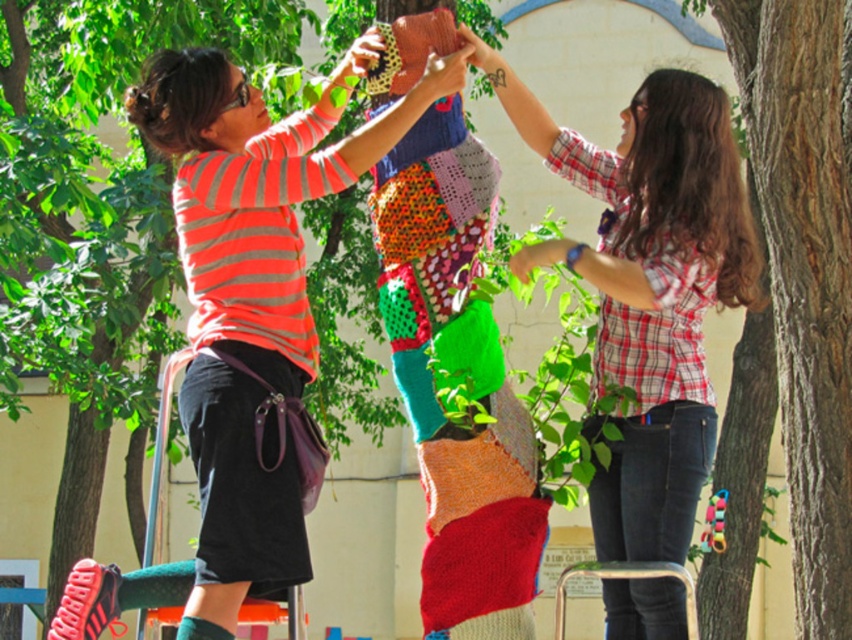
Question: Is plaid shirt at upper right positioned behind rough bark tree at upper right?

Choices:
 (A) yes
 (B) no

Answer: (B)

Question: Is plaid shirt at upper right positioned in front of rough bark tree at upper right?

Choices:
 (A) yes
 (B) no

Answer: (A)

Question: Estimate the real-world distances between objects in this image. Which object is closer to the plaid shirt at upper right?

Choices:
 (A) rough bark tree at upper right
 (B) knitted fabric doll at center

Answer: (B)

Question: Considering the real-world distances, which object is closest to the knitted fabric doll at center?

Choices:
 (A) plaid shirt at upper right
 (B) rough bark tree at upper right

Answer: (A)

Question: Which object is positioned closest to the knitted fabric doll at center?

Choices:
 (A) plaid shirt at upper right
 (B) rough bark tree at upper right

Answer: (A)

Question: Is knitted fabric doll at center in front of plaid shirt at upper right?

Choices:
 (A) no
 (B) yes

Answer: (B)